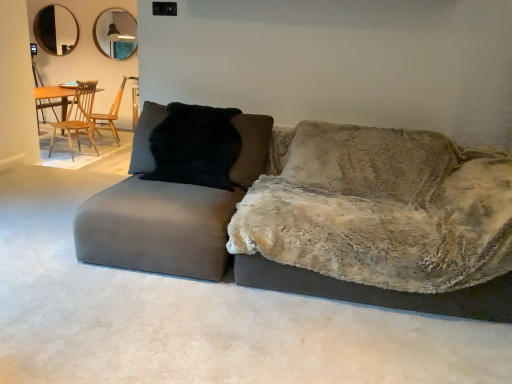
Question: Considering the relative positions of velvet gray couch at center and wooden chair at left, arranged as the first chair when viewed from the front, in the image provided, is velvet gray couch at center to the right of wooden chair at left, arranged as the first chair when viewed from the front, from the viewer's perspective?

Choices:
 (A) yes
 (B) no

Answer: (A)

Question: Is velvet gray couch at center positioned with its back to wooden chair at left, marked as the second chair in a back-to-front arrangement?

Choices:
 (A) yes
 (B) no

Answer: (B)

Question: From the image's perspective, is velvet gray couch at center located above wooden chair at left, arranged as the first chair when viewed from the front?

Choices:
 (A) no
 (B) yes

Answer: (A)

Question: From a real-world perspective, is velvet gray couch at center on wooden chair at left, marked as the second chair in a back-to-front arrangement?

Choices:
 (A) no
 (B) yes

Answer: (B)

Question: From the image's perspective, would you say velvet gray couch at center is shown under wooden chair at left, arranged as the first chair when viewed from the front?

Choices:
 (A) no
 (B) yes

Answer: (B)

Question: From a real-world perspective, is wooden chair at left, marked as the second chair in a back-to-front arrangement, physically located above or below matte silver mirror at upper center, arranged as the 2th mirror when viewed from the left?

Choices:
 (A) below
 (B) above

Answer: (A)

Question: Is wooden chair at left, arranged as the first chair when viewed from the front, spatially inside matte silver mirror at upper center, the 1th mirror in the right-to-left sequence, or outside of it?

Choices:
 (A) inside
 (B) outside

Answer: (B)

Question: Does point (76, 107) appear closer or farther from the camera than point (111, 26)?

Choices:
 (A) closer
 (B) farther

Answer: (A)

Question: Considering the relative positions of wooden chair at left, arranged as the first chair when viewed from the front, and matte silver mirror at upper center, arranged as the 2th mirror when viewed from the left, in the image provided, is wooden chair at left, arranged as the first chair when viewed from the front, to the left or to the right of matte silver mirror at upper center, arranged as the 2th mirror when viewed from the left,?

Choices:
 (A) left
 (B) right

Answer: (B)

Question: Is velvet gray couch at center situated inside matte silver mirror at upper center, the 1th mirror in the right-to-left sequence, or outside?

Choices:
 (A) inside
 (B) outside

Answer: (B)

Question: Is velvet gray couch at center in front of or behind matte silver mirror at upper center, the 1th mirror in the right-to-left sequence, in the image?

Choices:
 (A) behind
 (B) front

Answer: (B)

Question: Does point pos(159,105) appear closer or farther from the camera than point pos(126,26)?

Choices:
 (A) closer
 (B) farther

Answer: (A)

Question: From a real-world perspective, relative to matte silver mirror at upper center, arranged as the 2th mirror when viewed from the left, is velvet gray couch at center vertically above or below?

Choices:
 (A) above
 (B) below

Answer: (B)

Question: In the image, is velvet gray couch at center positioned in front of or behind black glass mirror at upper left, the 2th mirror when ordered from right to left?

Choices:
 (A) behind
 (B) front

Answer: (B)

Question: Looking at their shapes, would you say velvet gray couch at center is wider or thinner than black glass mirror at upper left, marked as the 1th mirror in a left-to-right arrangement?

Choices:
 (A) wide
 (B) thin

Answer: (A)